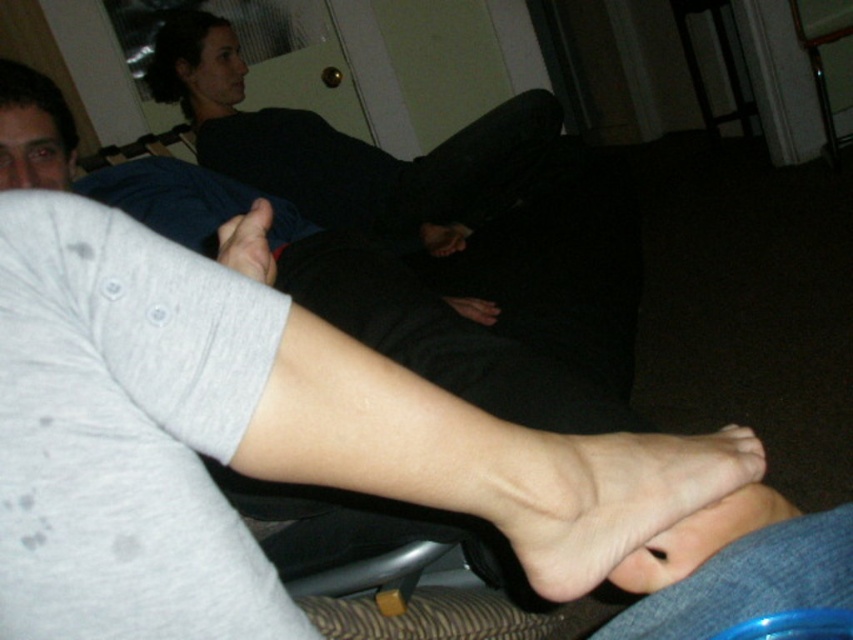
You are a robot trying to place a small object on the couch. The skinny white foot at lower center is currently occupying a spot at coordinates 0.772, 0.707. Can you place the object there without moving the foot?

The skinny white foot at lower center is already at position (602,493), so you cannot place the object there without moving the foot.

You are a photographer adjusting your camera to focus on the smooth skin foot at lower center and the matte skin toe at center. Which object should you focus on first to ensure proper depth of field?

The smooth skin foot at lower center is closer to the viewer than the matte skin toe at center, so you should focus on the smooth skin foot at lower center first to ensure proper depth of field.

You are a photographer setting up a shoot in this living room. You need to place a small prop between the skinny white foot at lower center and the smooth skin foot at lower center. Based on their positions, which foot should the prop be closer to?

The prop should be placed closer to the smooth skin foot at lower center because the skinny white foot at lower center is positioned on the left side of it.